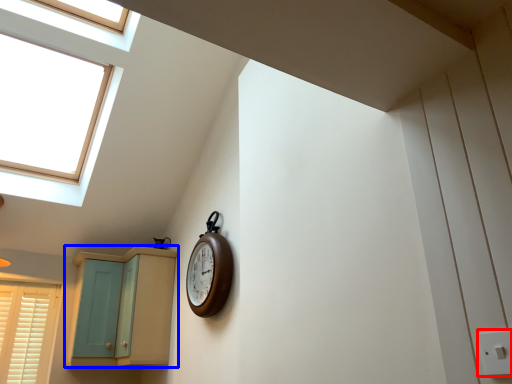
Question: Which of the following is the farthest to the observer, electric outlet (highlighted by a red box) or cabinetry (highlighted by a blue box)?

Choices:
 (A) electric outlet
 (B) cabinetry

Answer: (B)